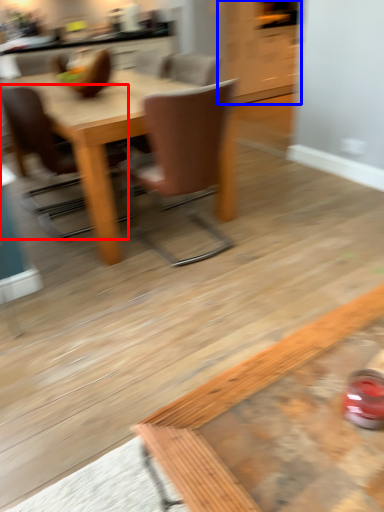
Question: Which object appears farthest to the camera in this image, chair (highlighted by a red box) or cabinetry (highlighted by a blue box)?

Choices:
 (A) chair
 (B) cabinetry

Answer: (B)